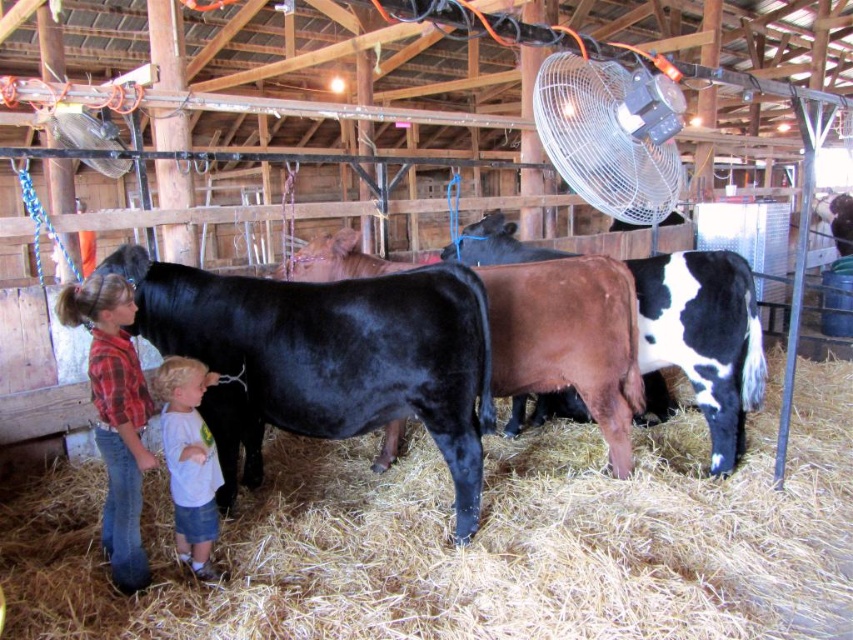
You are a painter standing in the barn and want to hang a new painting between the metallic silver fan at upper center and the white cotton shirt at lower left. Based on their heights, which object should you place the painting closer to?

The metallic silver fan at upper center is not as tall as the white cotton shirt at lower left, so the painting should be placed closer to the metallic silver fan at upper center to ensure proper alignment between the two objects.

You are standing in the barn and want to place a small stool between the two points labeled point (x=694, y=480) and point (x=132, y=304). Which point is closer to you where you should place the stool?

Point (x=694, y=480) is closer to you than point (x=132, y=304), so you should place the stool closer to point (x=694, y=480).

You are standing in the barn and want to find the black smooth bull at center. Based on the coordinates provided, where should you look relative to the barn entrance?

The black smooth bull at center is located at coordinates approximately 56.1 percent from the left edge and 38.3 percent from the top edge of the barn. Since barn entrances are typically centered, you should look slightly to the right and downward from the entrance to find the bull.